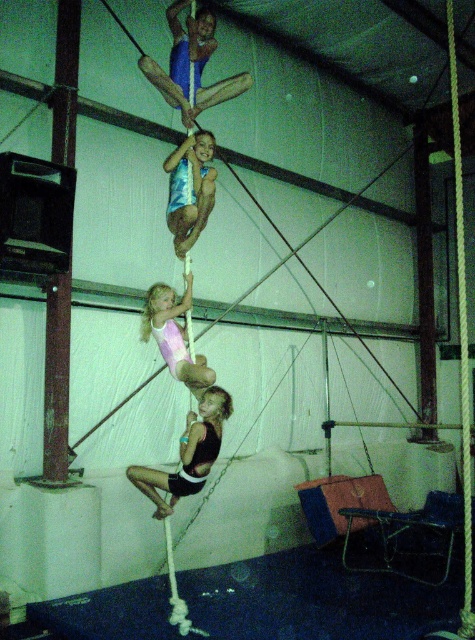
In the circus scene, there are two performers wearing the black fabric shorts at center and the pink leotard at center. Which performer is positioned to the left?

The black fabric shorts at center is to the left of pink leotard at center.

Based on the photo, you are a photographer positioned at the front of the circus tent. You want to capture a closeup shot of the point at coordinates point (190, 225) and point (157, 323). Which point should you focus on first to ensure it is in sharp focus?

Point (190, 225) is further to the camera than point (157, 323), so you should focus on point (190, 225) first to ensure it is in sharp focus.